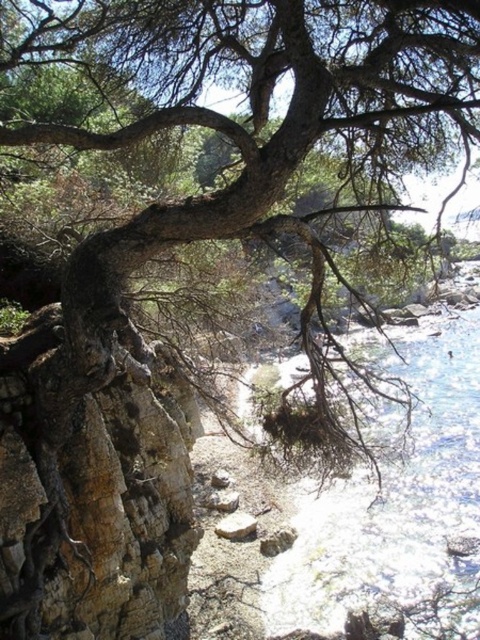
Question: Among these objects, which one is nearest to the camera?

Choices:
 (A) gray rough stone at center
 (B) clear blue water at lower right

Answer: (B)

Question: Is clear blue water at lower right wider than gray rough stone at center?

Choices:
 (A) no
 (B) yes

Answer: (B)

Question: Does clear blue water at lower right appear on the right side of gray rough stone at center?

Choices:
 (A) yes
 (B) no

Answer: (A)

Question: Is clear blue water at lower right to the right of gray rough stone at center from the viewer's perspective?

Choices:
 (A) yes
 (B) no

Answer: (A)